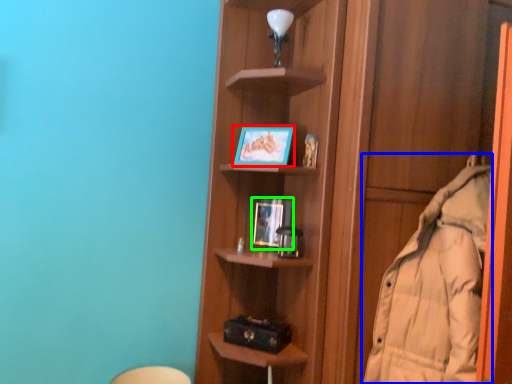
Question: Which is farther away from picture frame (highlighted by a red box)? coat (highlighted by a blue box) or picture frame (highlighted by a green box)?

Choices:
 (A) coat
 (B) picture frame

Answer: (A)